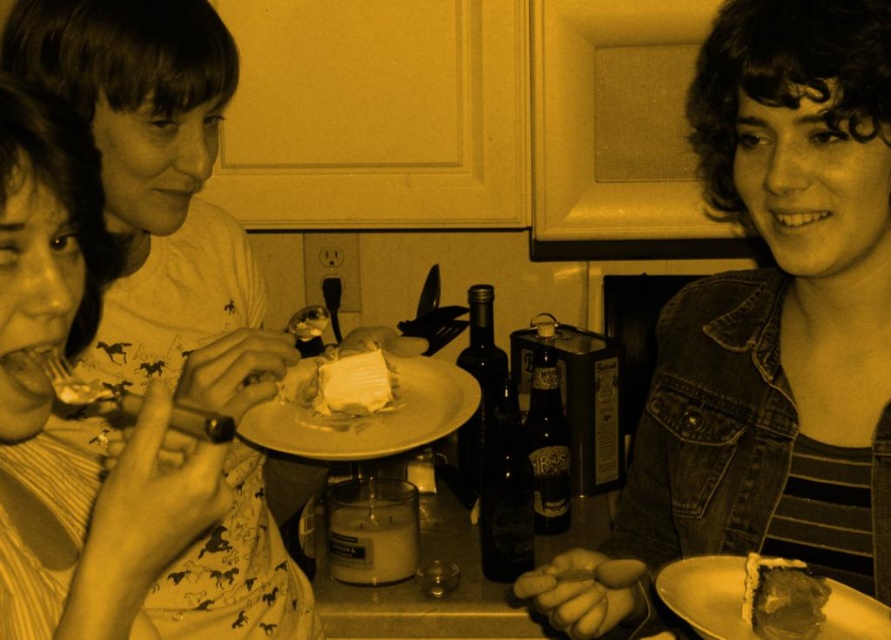
Which is behind, point (14, 211) or point (254, 419)?

The point (254, 419) is more distant.

Is matte white shirt at upper left further to the viewer compared to white matte plate at center?

No, it is not.

Find the location of `matte white shirt at upper left`. matte white shirt at upper left is located at coordinates (41, 253).

You are a GUI agent. You are given a task and a screenshot of the screen. Output one action in this format:
    pyautogui.click(x=<x>, y=<y>)
    Task: Click on the matte white shirt at upper left
    
    Given the screenshot: What is the action you would take?
    pyautogui.click(x=41, y=253)

Does white matte plate at center have a larger size compared to dark brown cake at lower right?

Indeed, white matte plate at center has a larger size compared to dark brown cake at lower right.

Who is more distant from viewer, [455,404] or [785,604]?

The point [455,404] is behind.

The image size is (891, 640). I want to click on white matte plate at center, so click(364, 412).

Is denim jacket at upper right below matte white shirt at upper left?

Incorrect, denim jacket at upper right is not positioned below matte white shirt at upper left.

You are a GUI agent. You are given a task and a screenshot of the screen. Output one action in this format:
    pyautogui.click(x=<x>, y=<y>)
    Task: Click on the denim jacket at upper right
    The width and height of the screenshot is (891, 640).
    Given the screenshot: What is the action you would take?
    [769, 323]

Identify the location of denim jacket at upper right. Image resolution: width=891 pixels, height=640 pixels. (769, 323).